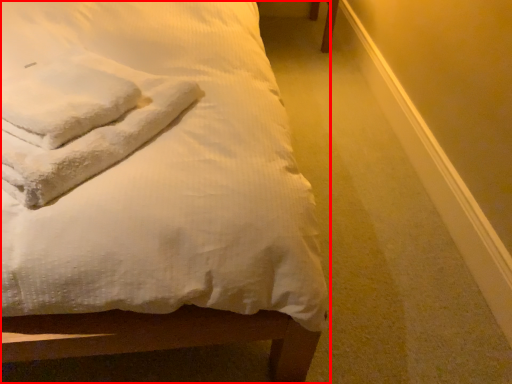
Question: Where is bed (annotated by the red box) located in relation to cloth in the image?

Choices:
 (A) right
 (B) left

Answer: (B)